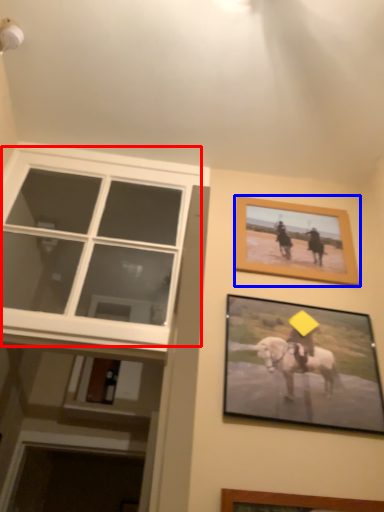
Question: Which of the following is the closest to the observer, window (highlighted by a red box) or picture frame (highlighted by a blue box)?

Choices:
 (A) window
 (B) picture frame

Answer: (A)